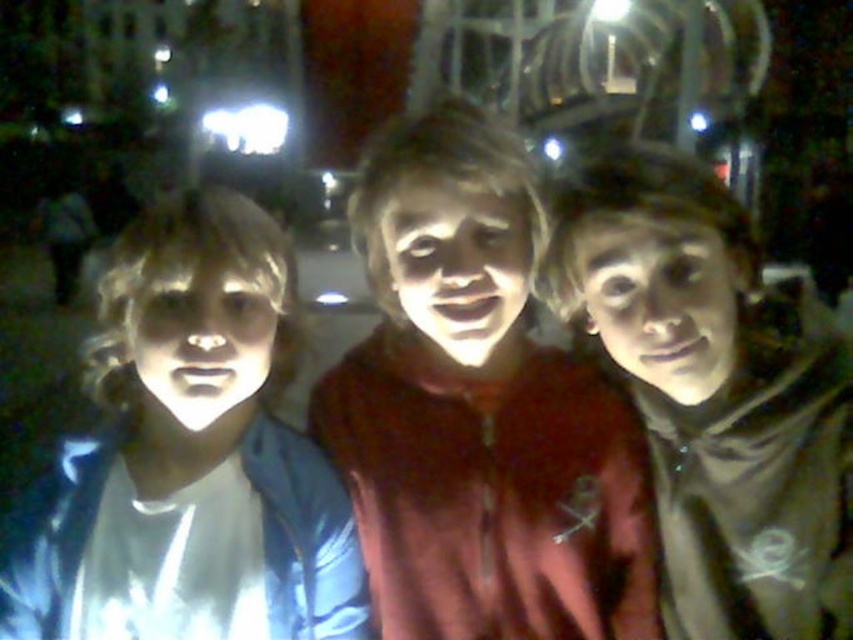
You are a photographer trying to adjust the lighting for a better shot. Given the current setup, which object between the matte blue jacket at left and the matte black hoodie at center would require more fill light to reduce shadows?

The matte blue jacket at left has a lesser height compared to the matte black hoodie at center, so it would require more fill light to reduce shadows because it is shorter and might be in a darker area.

You are a photographer trying to adjust the lighting for a group photo. You notice the matte red hoodie at center and the matte blue jacket at left. Which clothing item requires more light to ensure it is properly illuminated in the photo?

The matte red hoodie at center requires more light because it is bigger than the matte blue jacket at left, so it needs more illumination to be properly seen.

You are standing in the scene and want to move from the point at coordinates point (x=318, y=385) to the point at coordinates point (x=703, y=362). Which direction should you face to move towards the second point?

Since point (x=318, y=385) is closer to you than point (x=703, y=362), you should face away from the viewer to move towards the second point.